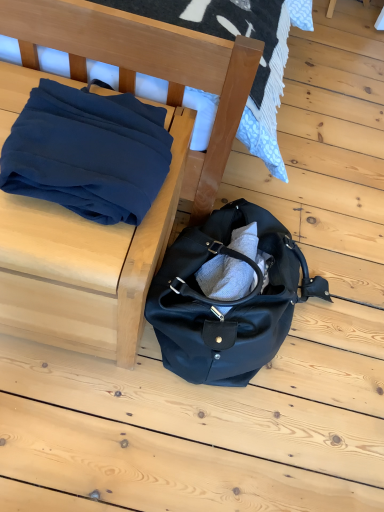
Question: Does navy blue fabric at upper left have a larger size compared to matte black duffel bag at lower center?

Choices:
 (A) yes
 (B) no

Answer: (B)

Question: Could you tell me if navy blue fabric at upper left is turned towards matte black duffel bag at lower center?

Choices:
 (A) yes
 (B) no

Answer: (B)

Question: Is navy blue fabric at upper left oriented away from matte black duffel bag at lower center?

Choices:
 (A) yes
 (B) no

Answer: (B)

Question: Is navy blue fabric at upper left not within matte black duffel bag at lower center?

Choices:
 (A) no
 (B) yes

Answer: (B)

Question: Is matte black duffel bag at lower center inside navy blue fabric at upper left?

Choices:
 (A) no
 (B) yes

Answer: (A)

Question: In terms of width, does matte blue fabric at left look wider or thinner when compared to matte black duffel bag at lower center?

Choices:
 (A) wide
 (B) thin

Answer: (B)

Question: Is point (206, 155) closer or farther from the camera than point (162, 287)?

Choices:
 (A) closer
 (B) farther

Answer: (B)

Question: Would you say matte blue fabric at left is inside or outside matte black duffel bag at lower center?

Choices:
 (A) outside
 (B) inside

Answer: (A)

Question: From the image's perspective, is matte blue fabric at left above or below matte black duffel bag at lower center?

Choices:
 (A) below
 (B) above

Answer: (B)

Question: Looking at the image, does navy blue fabric at upper left seem bigger or smaller compared to matte black duffel bag at lower center?

Choices:
 (A) small
 (B) big

Answer: (A)

Question: Would you say navy blue fabric at upper left is to the left or to the right of matte black duffel bag at lower center in the picture?

Choices:
 (A) left
 (B) right

Answer: (A)

Question: From the image's perspective, is navy blue fabric at upper left above or below matte black duffel bag at lower center?

Choices:
 (A) below
 (B) above

Answer: (B)

Question: Relative to matte black duffel bag at lower center, is navy blue fabric at upper left in front or behind?

Choices:
 (A) behind
 (B) front

Answer: (B)

Question: Is point (233, 138) closer or farther from the camera than point (26, 140)?

Choices:
 (A) farther
 (B) closer

Answer: (A)

Question: From a real-world perspective, relative to navy blue fabric at upper left, is matte blue fabric at left vertically above or below?

Choices:
 (A) above
 (B) below

Answer: (B)